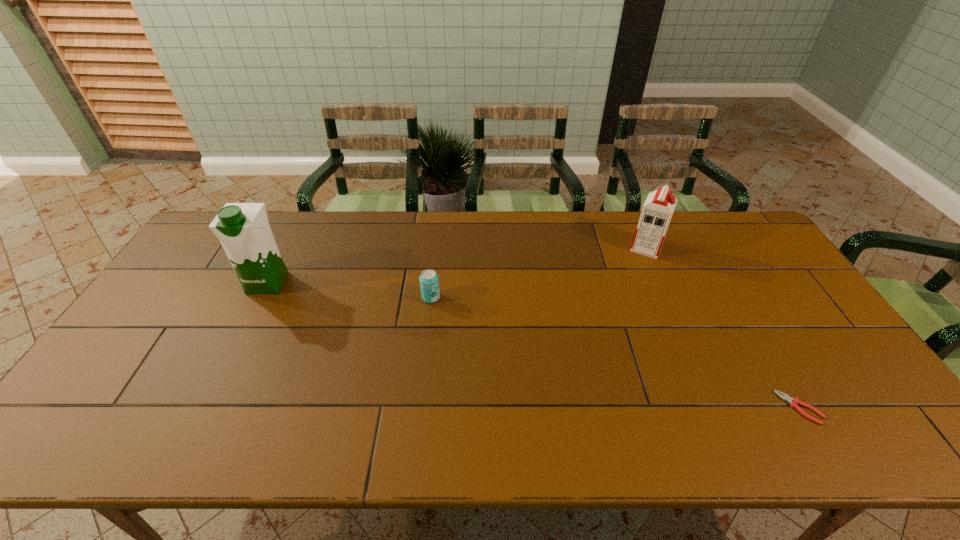
This screenshot has width=960, height=540. I want to click on object that stands as the third closest to the second object from right to left, so click(243, 229).

At what (x,y) coordinates should I click in order to perform the action: click on object identified as the second closest to the farthest object. Please return your answer as a coordinate pair (x, y). Image resolution: width=960 pixels, height=540 pixels. Looking at the image, I should click on (429, 283).

I want to click on vacant area that satisfies the following two spatial constraints: 1. on the front-facing side of the leftmost object; 2. on the right side of the shortest object, so click(x=204, y=408).

Find the location of a particular element. vacant space that satisfies the following two spatial constraints: 1. on the front-facing side of the leftmost object; 2. on the left side of the beer can is located at coordinates (260, 298).

Find the location of `free location that satisfies the following two spatial constraints: 1. on the front-facing side of the beer can; 2. on the left side of the taller soya milk`. free location that satisfies the following two spatial constraints: 1. on the front-facing side of the beer can; 2. on the left side of the taller soya milk is located at coordinates (260, 298).

At what (x,y) coordinates should I click in order to perform the action: click on vacant space that satisfies the following two spatial constraints: 1. on the front-facing side of the left soya milk; 2. on the right side of the beer can. Please return your answer as a coordinate pair (x, y). This screenshot has width=960, height=540. Looking at the image, I should click on (260, 298).